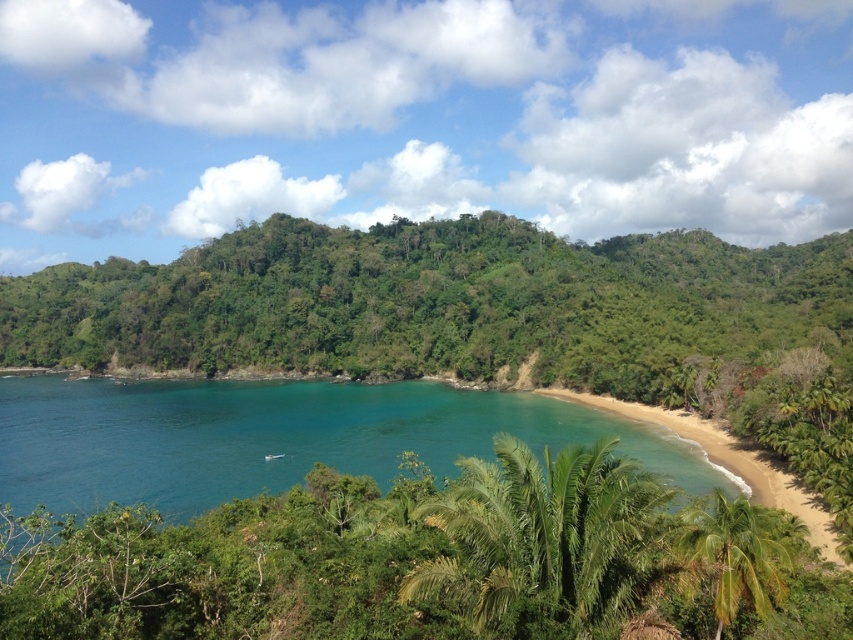
Question: Is teal glossy water at center to the right of green leafy palm tree at lower center from the viewer's perspective?

Choices:
 (A) no
 (B) yes

Answer: (A)

Question: Which object is positioned farthest from the green leafy palm tree at lower right?

Choices:
 (A) green leafy palm tree at lower center
 (B) teal glossy water at center

Answer: (B)

Question: Is teal glossy water at center positioned in front of green leafy palm tree at lower center?

Choices:
 (A) no
 (B) yes

Answer: (A)

Question: Can you confirm if teal glossy water at center is smaller than green leafy palm tree at lower right?

Choices:
 (A) no
 (B) yes

Answer: (A)

Question: Considering the real-world distances, which object is closest to the teal glossy water at center?

Choices:
 (A) green leafy palm tree at lower center
 (B) green leafy palm tree at lower right

Answer: (A)

Question: Which point is closer to the camera?

Choices:
 (A) green leafy palm tree at lower right
 (B) teal glossy water at center
 (C) green leafy palm tree at lower center

Answer: (C)